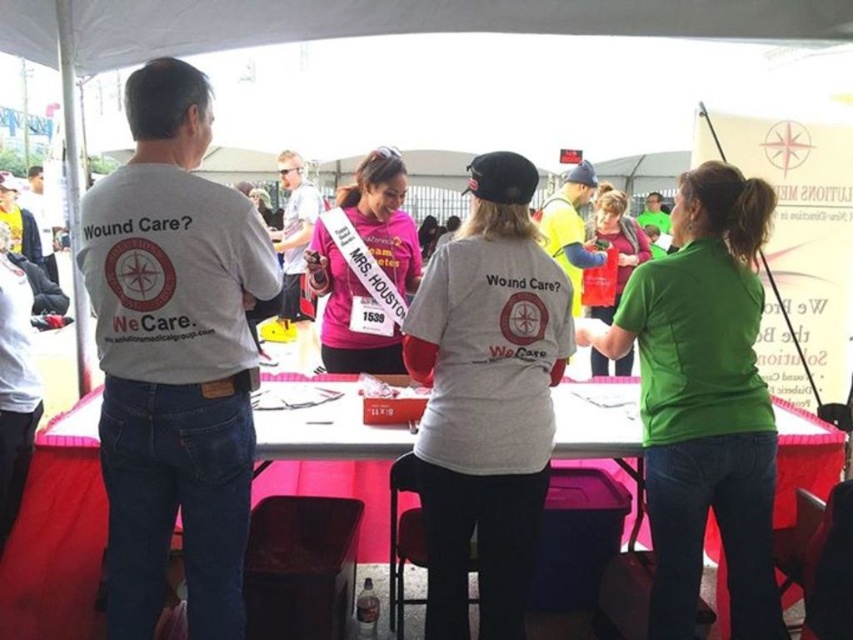
Between point (171, 300) and point (352, 282), which one is positioned behind?

The point (352, 282) is behind.

Between white cotton shirt at left and pink matte jersey at center, which one is positioned lower?

white cotton shirt at left is below.

Which is behind, point (120, 179) or point (375, 172)?

Positioned behind is point (375, 172).

Find the location of a particular element. white cotton shirt at left is located at coordinates (173, 356).

Is the position of white cotton shirt at left more distant than that of matte pink shirt at center?

No, white cotton shirt at left is closer to the viewer.

Which of these two, white cotton shirt at left or matte pink shirt at center, stands shorter?

matte pink shirt at center is shorter.

Between point (236, 205) and point (312, 301), which one is positioned behind?

Positioned behind is point (312, 301).

Locate an element on the screen. This screenshot has width=853, height=640. white cotton shirt at left is located at coordinates (173, 356).

Is white matte shirt at center taller than green matte shirt at center?

No, white matte shirt at center is not taller than green matte shirt at center.

Is white matte shirt at center smaller than green matte shirt at center?

Yes, white matte shirt at center is smaller than green matte shirt at center.

Between point (471, 179) and point (767, 566), which one is positioned in front?

Point (471, 179)

Locate an element on the screen. The width and height of the screenshot is (853, 640). white matte shirt at center is located at coordinates (486, 397).